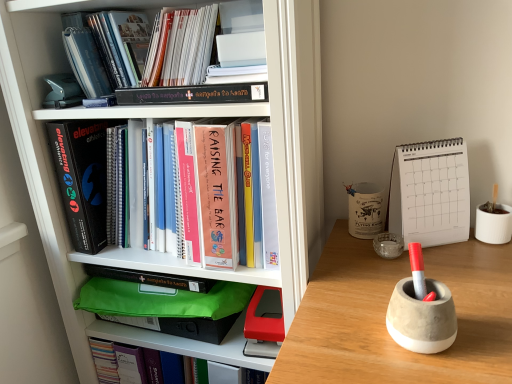
Question: Considering the relative sizes of hardcover book at upper center, which ranks as the 3th book in top-to-bottom order, and concrete pen holder at right, the third stationery positioned from the back, in the image provided, is hardcover book at upper center, which ranks as the 3th book in top-to-bottom order, bigger than concrete pen holder at right, the third stationery positioned from the back,?

Choices:
 (A) no
 (B) yes

Answer: (B)

Question: Would you consider hardcover book at upper center, which ranks as the 3th book in top-to-bottom order, to be distant from concrete pen holder at right, the third stationery positioned from the back?

Choices:
 (A) yes
 (B) no

Answer: (B)

Question: Does hardcover book at upper center, which ranks as the 3th book in top-to-bottom order, have a greater height compared to concrete pen holder at right, which is the first stationery from bottom to top?

Choices:
 (A) no
 (B) yes

Answer: (B)

Question: From a real-world perspective, is hardcover book at upper center, the second book when ordered from bottom to top, over concrete pen holder at right, the 1th stationery viewed from the front?

Choices:
 (A) yes
 (B) no

Answer: (A)

Question: Is hardcover book at upper center, which ranks as the 3th book in top-to-bottom order, with concrete pen holder at right, the 1th stationery viewed from the front?

Choices:
 (A) no
 (B) yes

Answer: (A)

Question: Is black matte book at left, which ranks as the first paperback book in left-to-right order, spatially inside white matte bookcase at left, or outside of it?

Choices:
 (A) inside
 (B) outside

Answer: (A)

Question: In terms of width, does black matte book at left, which ranks as the first paperback book in left-to-right order, look wider or thinner when compared to white matte bookcase at left?

Choices:
 (A) thin
 (B) wide

Answer: (A)

Question: Visually, is black matte book at left, which ranks as the first paperback book in left-to-right order, positioned to the left or to the right of white matte bookcase at left?

Choices:
 (A) left
 (B) right

Answer: (A)

Question: In terms of height, does black matte book at left, the second paperback book positioned from the right, look taller or shorter compared to white matte bookcase at left?

Choices:
 (A) short
 (B) tall

Answer: (A)

Question: From a real-world perspective, relative to white matte bookcase at left, is hardcover book at upper left, placed as the 3th book when sorted from bottom to top, vertically above or below?

Choices:
 (A) below
 (B) above

Answer: (B)

Question: From the image's perspective, is hardcover book at upper left, which appears as the second book when viewed from the top, above or below white matte bookcase at left?

Choices:
 (A) above
 (B) below

Answer: (A)

Question: Which is correct: hardcover book at upper left, placed as the 3th book when sorted from bottom to top, is inside white matte bookcase at left, or outside of it?

Choices:
 (A) outside
 (B) inside

Answer: (B)

Question: Considering the positions of point (116, 71) and point (15, 140), is point (116, 71) closer or farther from the camera than point (15, 140)?

Choices:
 (A) closer
 (B) farther

Answer: (B)

Question: From a real-world perspective, is matte paper folder at upper center, arranged as the 4th book when ordered from the bottom, above or below clear glass ashtray at center-right, the second stationery when ordered from back to front?

Choices:
 (A) above
 (B) below

Answer: (A)

Question: Visually, is matte paper folder at upper center, placed as the first book when sorted from top to bottom, positioned to the left or to the right of clear glass ashtray at center-right, which is the 2th stationery in top-to-bottom order?

Choices:
 (A) right
 (B) left

Answer: (B)